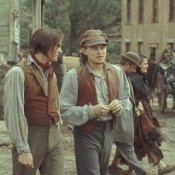
At what (x,y) coordinates should I click in order to perform the action: click on window. Please return your answer as a coordinate pair (x, y). The height and width of the screenshot is (175, 175). Looking at the image, I should click on (129, 8), (140, 17), (154, 18), (172, 17), (171, 45), (140, 47), (128, 47).